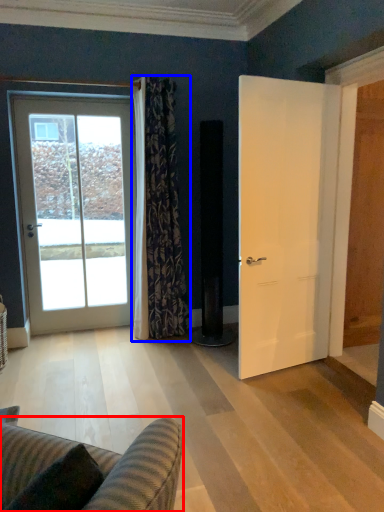
Question: Which object appears closest to the camera in this image, studio couch (highlighted by a red box) or curtain (highlighted by a blue box)?

Choices:
 (A) studio couch
 (B) curtain

Answer: (A)